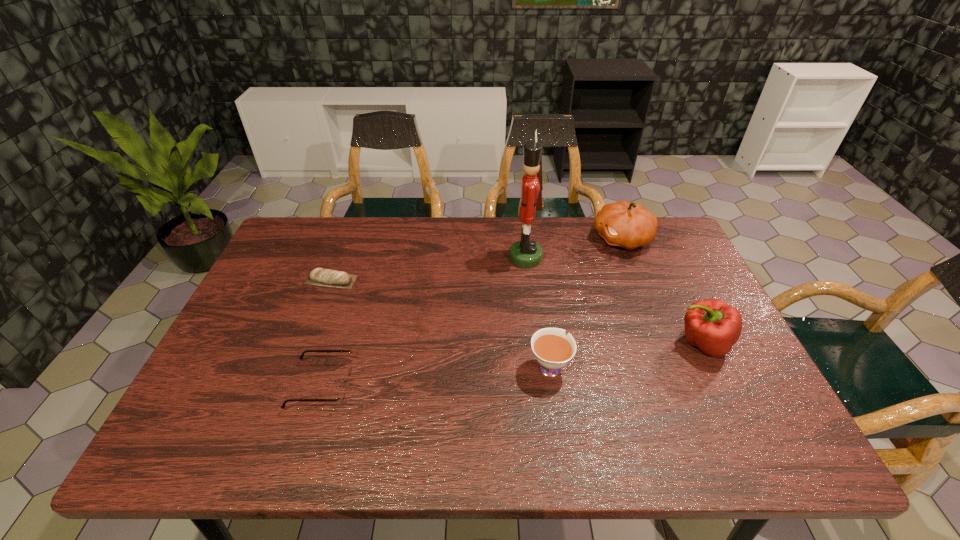
Where is `nutcracker`? This screenshot has width=960, height=540. nutcracker is located at coordinates (525, 253).

I want to click on the second tallest object, so click(x=624, y=224).

You are a GUI agent. You are given a task and a screenshot of the screen. Output one action in this format:
    pyautogui.click(x=<x>, y=<y>)
    Task: Click on the third tallest object
    
    Given the screenshot: What is the action you would take?
    pyautogui.click(x=713, y=326)

Where is `teacup`? teacup is located at coordinates (553, 349).

Identify the location of spectacles. (341, 398).

This screenshot has height=540, width=960. I want to click on the shortest object, so click(322, 277).

Find the location of a particular element. This screenshot has width=960, height=540. pita bread is located at coordinates (322, 277).

Locate an element on the screen. This screenshot has height=540, width=960. vacant area situated 0.350m on the front-facing side of the tallest object is located at coordinates (396, 258).

Identify the location of vacant space situated on the front-facing side of the tallest object. (454, 258).

The width and height of the screenshot is (960, 540). In order to click on free space located on the front-facing side of the tallest object in this screenshot , I will do `click(384, 258)`.